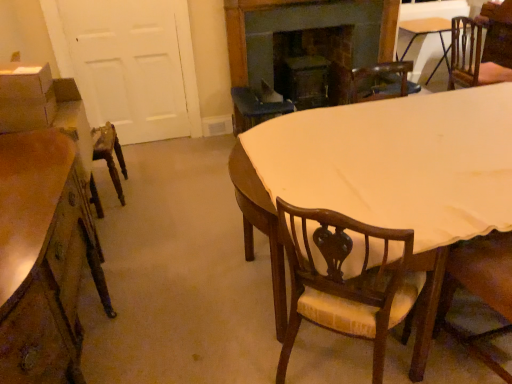
This screenshot has height=384, width=512. What do you see at coordinates (479, 289) in the screenshot?
I see `wooden chair with cushion at lower right, which is counted as the second chair, starting from the bottom` at bounding box center [479, 289].

I want to click on wooden chair with cushion at lower right, placed as the first chair when sorted from front to back, so click(x=479, y=289).

Locate an element on the screen. wooden table at upper right is located at coordinates (426, 34).

Locate an element on the screen. The image size is (512, 384). brown wood chair at upper right, marked as the 1th chair in a right-to-left arrangement is located at coordinates (478, 50).

You are a GUI agent. You are given a task and a screenshot of the screen. Output one action in this format:
    pyautogui.click(x=<x>, y=<y>)
    Task: Click on the wooden chair with upholstered seat at center, which appears as the 3th chair when viewed from the top
    The image size is (512, 384).
    Given the screenshot: What is the action you would take?
    pyautogui.click(x=357, y=284)

Where is `matte cardboard box at left`? Image resolution: width=512 pixels, height=384 pixels. matte cardboard box at left is located at coordinates (26, 97).

This screenshot has height=384, width=512. Find the location of `dark wood fireplace at upper center`. dark wood fireplace at upper center is located at coordinates (310, 28).

From a real-world perspective, is wooden chair with upholstered seat at center, which appears as the 3th chair when viewed from the top, on wooden desk at left?

Correct, in the physical world, wooden chair with upholstered seat at center, which appears as the 3th chair when viewed from the top, is higher than wooden desk at left.

Is wooden chair with upholstered seat at center, which is the 2th chair in front-to-back order, outside of wooden desk at left?

wooden chair with upholstered seat at center, which is the 2th chair in front-to-back order, is positioned outside wooden desk at left.

Who is bigger, wooden chair with upholstered seat at center, which appears as the 3th chair when viewed from the top, or wooden desk at left?

wooden desk at left is bigger.

Based on the photo, is the surface of wooden chair with upholstered seat at center, marked as the 3th chair in a right-to-left arrangement, in direct contact with wooden desk at left?

wooden chair with upholstered seat at center, marked as the 3th chair in a right-to-left arrangement, and wooden desk at left are clearly separated.

Which of these two, matte cardboard box at left or light brown wooden table at center, stands shorter?

With less height is matte cardboard box at left.

Are matte cardboard box at left and light brown wooden table at center far apart?

matte cardboard box at left is positioned a significant distance from light brown wooden table at center.

From a real-world perspective, is matte cardboard box at left below light brown wooden table at center?

Incorrect, from a real-world perspective, matte cardboard box at left is higher than light brown wooden table at center.

In the scene shown: Considering the relative sizes of wooden table at upper right and wooden chair with cushion at lower right, which is counted as the second chair, starting from the bottom, in the image provided, is wooden table at upper right thinner than wooden chair with cushion at lower right, which is counted as the second chair, starting from the bottom,?

No.

Is wooden table at upper right positioned with its back to wooden chair with cushion at lower right, the second chair positioned from the left?

No, wooden table at upper right's orientation is not away from wooden chair with cushion at lower right, the second chair positioned from the left.

Would you say wooden table at upper right is outside wooden chair with cushion at lower right, placed as the first chair when sorted from front to back?

Yes, wooden table at upper right is located beyond the bounds of wooden chair with cushion at lower right, placed as the first chair when sorted from front to back.

Where is `box above the wooden table at upper right (from a real-world perspective)`? This screenshot has width=512, height=384. box above the wooden table at upper right (from a real-world perspective) is located at coordinates (26, 97).

Does wooden table at upper right have a greater height compared to matte cardboard box at left?

Yes.

Is wooden table at upper right far from matte cardboard box at left?

Indeed, wooden table at upper right is not near matte cardboard box at left.

Is wooden table at upper right bigger or smaller than matte cardboard box at left?

In the image, wooden table at upper right appears to be larger than matte cardboard box at left.

Is brown wood chair at upper right, the third chair positioned from the bottom, positioned beyond the bounds of wooden table at upper right?

Yes, brown wood chair at upper right, the third chair positioned from the bottom, is not within wooden table at upper right.

From the image's perspective, does brown wood chair at upper right, which is the third chair from left to right, appear higher than wooden table at upper right?

No.

Considering the sizes of brown wood chair at upper right, the first chair when ordered from back to front, and wooden table at upper right in the image, is brown wood chair at upper right, the first chair when ordered from back to front, taller or shorter than wooden table at upper right?

Considering their sizes, brown wood chair at upper right, the first chair when ordered from back to front, has less height than wooden table at upper right.

Based on the photo, does brown wood chair at upper right, the first chair when ordered from back to front, appear on the left side of wooden table at upper right?

No.

Would you say wooden chair with upholstered seat at center, which appears as the 3th chair when viewed from the top, is part of wooden chair with cushion at lower right, which is counted as the second chair, starting from the bottom,'s contents?

No, wooden chair with upholstered seat at center, which appears as the 3th chair when viewed from the top, is located outside of wooden chair with cushion at lower right, which is counted as the second chair, starting from the bottom.

Is wooden chair with cushion at lower right, the 3th chair positioned from the back, facing towards wooden chair with upholstered seat at center, which is counted as the 1th chair, starting from the bottom?

No, wooden chair with cushion at lower right, the 3th chair positioned from the back, is not turned towards wooden chair with upholstered seat at center, which is counted as the 1th chair, starting from the bottom.

Is wooden chair with cushion at lower right, placed as the first chair when sorted from front to back, positioned in front of wooden chair with upholstered seat at center, which is counted as the 1th chair, starting from the bottom?

Yes, it is in front of wooden chair with upholstered seat at center, which is counted as the 1th chair, starting from the bottom.

From a real-world perspective, does wooden table at upper right stand above brown wood chair at upper right, the 1th chair viewed from the top?

No, from a real-world perspective, wooden table at upper right is not over brown wood chair at upper right, the 1th chair viewed from the top

Between wooden table at upper right and brown wood chair at upper right, which is the third chair from left to right, which one appears on the left side from the viewer's perspective?

Positioned to the left is wooden table at upper right.

Where is `table that appears above the brown wood chair at upper right, marked as the 1th chair in a right-to-left arrangement (from the image's perspective)`? table that appears above the brown wood chair at upper right, marked as the 1th chair in a right-to-left arrangement (from the image's perspective) is located at coordinates (426, 34).

Identify the location of desk below the wooden chair with upholstered seat at center, which is counted as the 1th chair, starting from the bottom (from a real-world perspective). (42, 258).

You are a GUI agent. You are given a task and a screenshot of the screen. Output one action in this format:
    pyautogui.click(x=<x>, y=<y>)
    Task: Click on the box positioned vertically above the light brown wooden table at center (from a real-world perspective)
    
    Given the screenshot: What is the action you would take?
    pyautogui.click(x=26, y=97)

Which object lies nearer to the anchor point wooden chair with upholstered seat at center, the second chair in the back-to-front sequence, wooden table at upper right or white matte door at left?

white matte door at left is positioned closer to the anchor wooden chair with upholstered seat at center, the second chair in the back-to-front sequence.

Looking at the image, which one is located closer to wooden chair with cushion at lower right, the second chair positioned from the left, brown wood chair at upper right, the third chair positioned from the bottom, or dark wood fireplace at upper center?

Based on the image, dark wood fireplace at upper center appears to be nearer to wooden chair with cushion at lower right, the second chair positioned from the left.

Estimate the real-world distances between objects in this image. Which object is closer to matte cardboard box at left, wooden chair with cushion at lower right, the second chair positioned from the left, or brown wood chair at upper right, which is the third chair from left to right?

The object closer to matte cardboard box at left is wooden chair with cushion at lower right, the second chair positioned from the left.

Looking at this image, based on their spatial positions, is dark wood fireplace at upper center or matte cardboard box at left further from wooden table at upper right?

matte cardboard box at left is further to wooden table at upper right.

Estimate the real-world distances between objects in this image. Which object is closer to white matte door at left, matte cardboard box at left or wooden chair with cushion at lower right, the 3th chair positioned from the back?

Based on the image, matte cardboard box at left appears to be nearer to white matte door at left.

Looking at the image, which one is located closer to brown wood chair at upper right, the 3th chair from the front, wooden chair with upholstered seat at center, which is counted as the 1th chair, starting from the bottom, or matte cardboard box at left?

wooden chair with upholstered seat at center, which is counted as the 1th chair, starting from the bottom, is closer to brown wood chair at upper right, the 3th chair from the front.

Estimate the real-world distances between objects in this image. Which object is further from light brown wooden table at center, dark wood fireplace at upper center or matte cardboard box at left?

Based on the image, dark wood fireplace at upper center appears to be further to light brown wooden table at center.

Estimate the real-world distances between objects in this image. Which object is further from light brown wooden table at center, wooden desk at left or dark wood fireplace at upper center?

dark wood fireplace at upper center is positioned further to the anchor light brown wooden table at center.

You are a GUI agent. You are given a task and a screenshot of the screen. Output one action in this format:
    pyautogui.click(x=<x>, y=<y>)
    Task: Click on the kitchen & dining room table between wooden desk at left and wooden table at upper right in the front-back direction
    This screenshot has width=512, height=384.
    Given the screenshot: What is the action you would take?
    pyautogui.click(x=260, y=207)

What are the coordinates of `kitchen & dining room table between wooden chair with cushion at lower right, which is counted as the second chair, starting from the bottom, and dark wood fireplace at upper center from front to back` in the screenshot? It's located at (260, 207).

Where is `box located between wooden chair with upholstered seat at center, the second chair in the back-to-front sequence, and dark wood fireplace at upper center in the depth direction`? box located between wooden chair with upholstered seat at center, the second chair in the back-to-front sequence, and dark wood fireplace at upper center in the depth direction is located at coordinates (26, 97).

The height and width of the screenshot is (384, 512). Find the location of `chair situated between wooden desk at left and light brown wooden table at center from left to right`. chair situated between wooden desk at left and light brown wooden table at center from left to right is located at coordinates (357, 284).